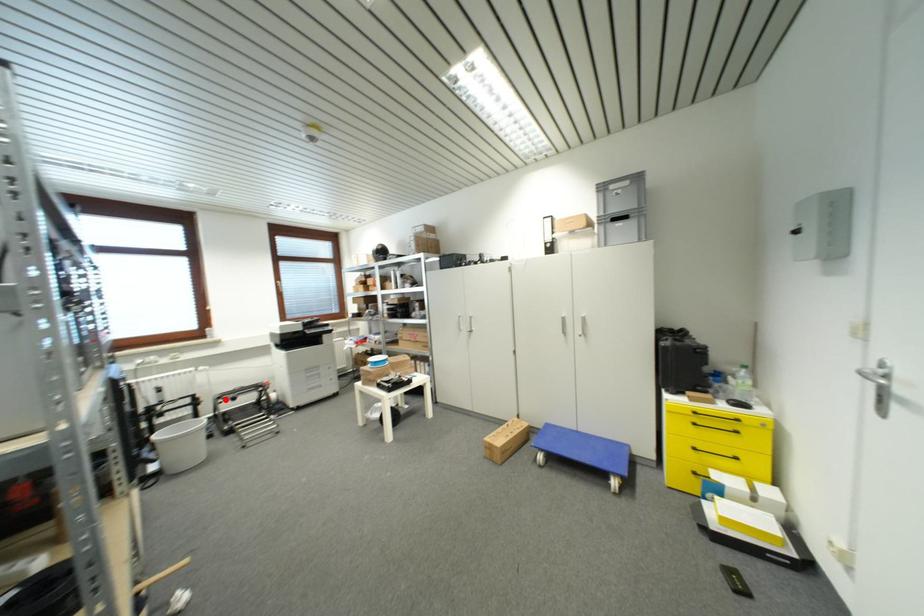
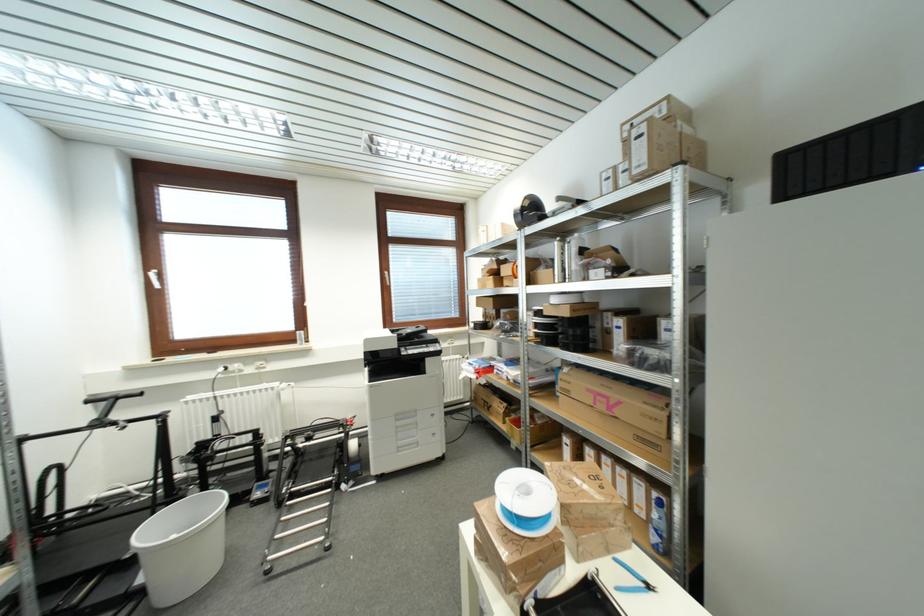
Question: I am providing you with two images of the same scene from different viewpoints. Image1 has a red point marked. In image2, the corresponding 3D location appears at what relative position? Reply with the corresponding letter.

Choices:
 (A) Closer
 (B) Farther

Answer: (B)